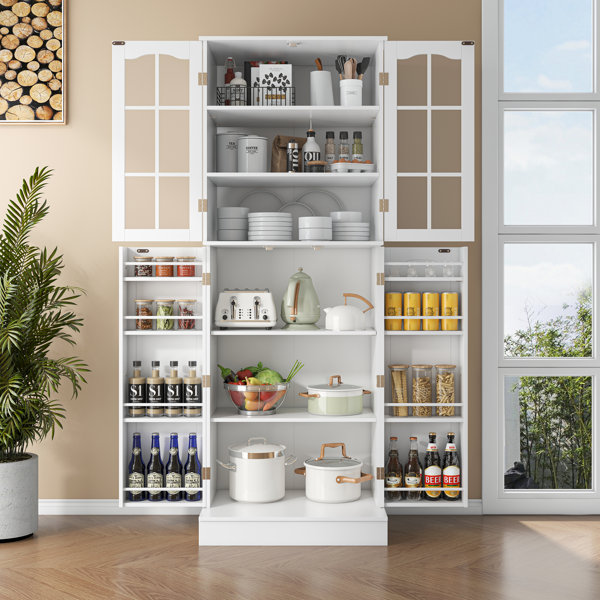
Where is `storage containers`? The image size is (600, 600). storage containers is located at coordinates (256, 160), (223, 154), (343, 104), (326, 95).